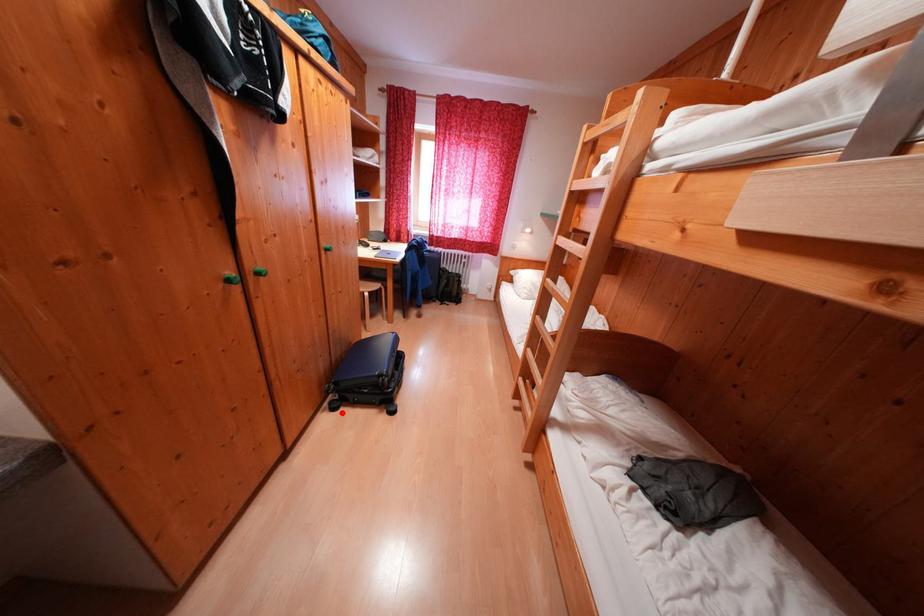
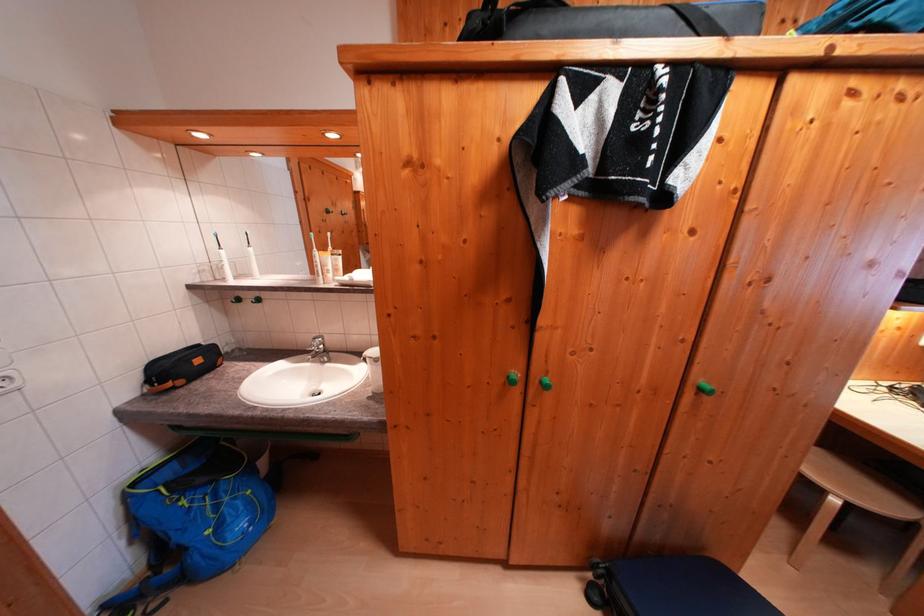
Find the pixel in the second image that matches the highlighted location in the first image.

(598, 602)